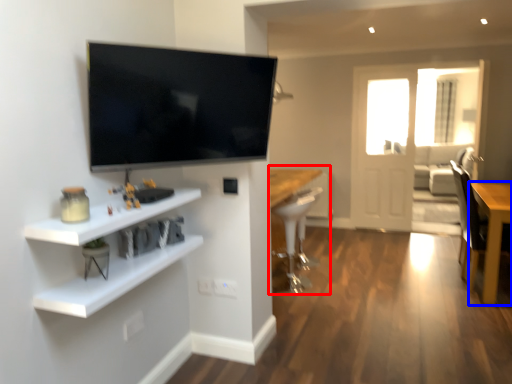
Question: Which of the following is the closest to the observer, computer desk (highlighted by a red box) or table (highlighted by a blue box)?

Choices:
 (A) computer desk
 (B) table

Answer: (B)